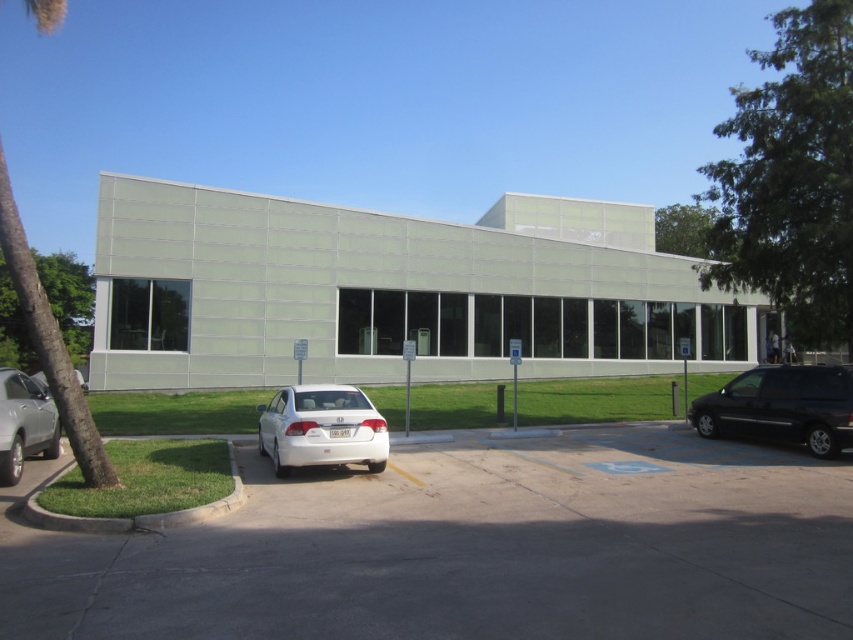
Question: Is black matte van at right further to camera compared to satin silver sedan at lower left?

Choices:
 (A) no
 (B) yes

Answer: (B)

Question: Is gray asphalt parking lot at center positioned in front of white glossy sedan at center?

Choices:
 (A) yes
 (B) no

Answer: (A)

Question: Which object is closer to the camera taking this photo?

Choices:
 (A) green textured palm tree at left
 (B) silver metallic sedan at center-left
 (C) white glossy sedan at center
 (D) black matte van at right

Answer: (A)

Question: Among these points, which one is farthest from the camera?

Choices:
 (A) (381, 449)
 (B) (28, 406)
 (C) (90, 412)
 (D) (39, 381)

Answer: (D)

Question: Where is black matte van at right located in relation to satin silver sedan at lower left in the image?

Choices:
 (A) above
 (B) below

Answer: (B)

Question: Which point appears closest to the camera in this image?

Choices:
 (A) (273, 486)
 (B) (76, 371)
 (C) (1, 476)
 (D) (711, 401)

Answer: (C)